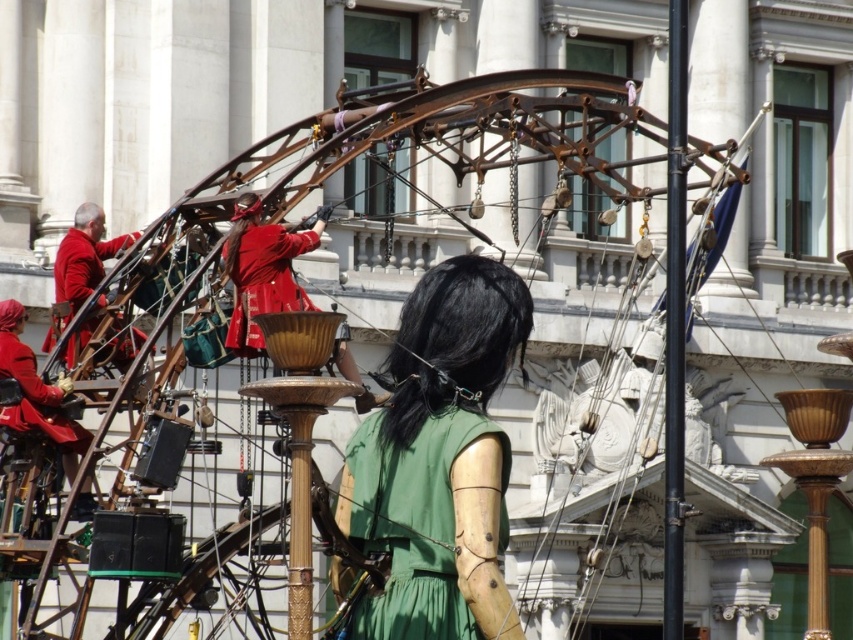
You are a photographer trying to capture the entire mechanical structure in one shot. You notice two points marked on the structure at coordinates point (x=409, y=534) and point (x=61, y=269). Which point is closer to your camera lens?

Point (x=409, y=534) is closer to the camera than point (x=61, y=269), so it will appear larger in the photograph.